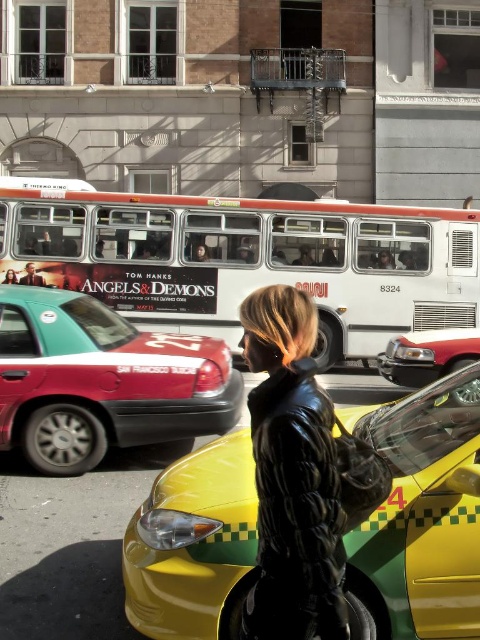
Question: Which object is the closest to the black leather coat at center?

Choices:
 (A) yellow matte taxi at center
 (B) teal glossy taxi at left
 (C) black leather jacket at center
 (D) metallic red taxi at center

Answer: (A)

Question: Is teal glossy taxi at left to the left of metallic red taxi at center from the viewer's perspective?

Choices:
 (A) no
 (B) yes

Answer: (B)

Question: Is metallic red taxi at center above leather jacket at center?

Choices:
 (A) yes
 (B) no

Answer: (B)

Question: Is teal glossy taxi at left thinner than leather jacket at center?

Choices:
 (A) no
 (B) yes

Answer: (A)

Question: Which of these objects is positioned farthest from the teal glossy taxi at left?

Choices:
 (A) white matte bus at center
 (B) black leather coat at center
 (C) black leather jacket at center

Answer: (A)

Question: Which object is farther from the camera taking this photo?

Choices:
 (A) black leather jacket at center
 (B) leather jacket at center

Answer: (A)